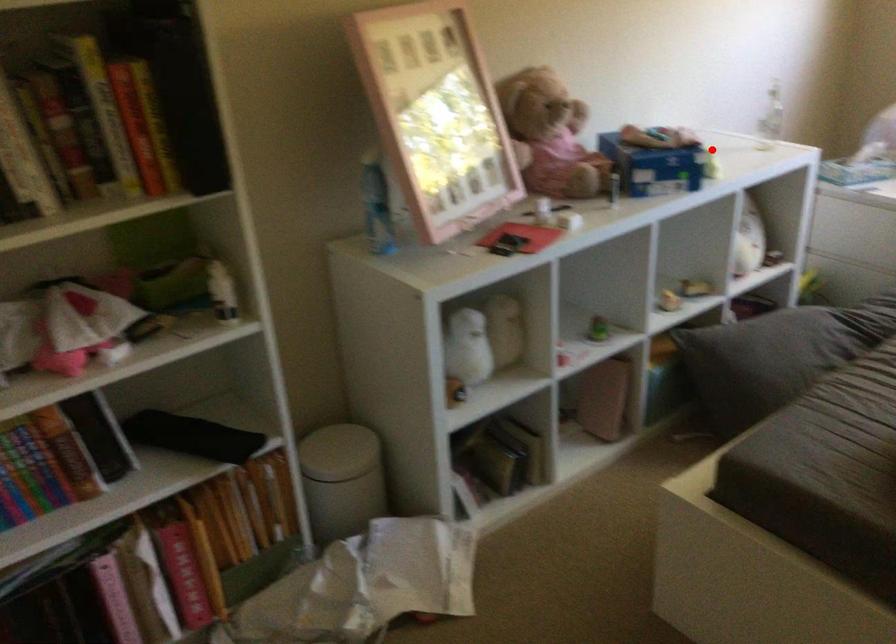
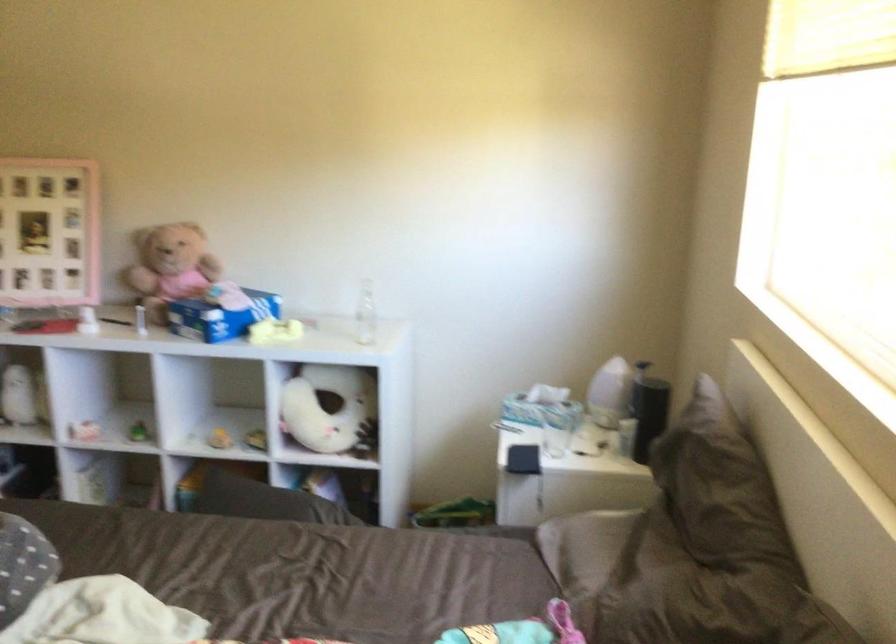
Where in the second image is the point corresponding to the highlighted location from the first image?

(220, 317)